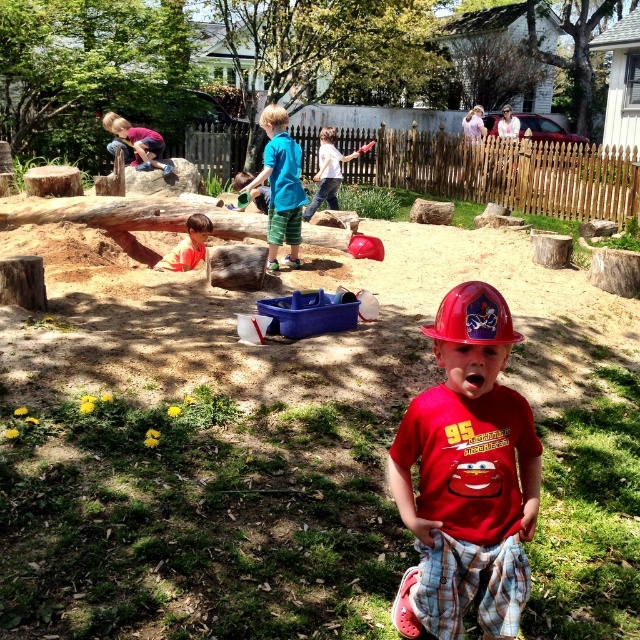
Question: Which is nearer to the matte purple shirt at upper left?

Choices:
 (A) blue cotton shirt at center
 (B) white cotton shirt at center
 (C) red matte helmet at center
 (D) red hard hat at center

Answer: (B)

Question: Is red matte helmet at center below matte purple shirt at upper left?

Choices:
 (A) no
 (B) yes

Answer: (B)

Question: Which of the following is the farthest from the observer?

Choices:
 (A) (294, 230)
 (B) (497, 300)

Answer: (A)

Question: Does blue cotton shirt at center appear under red hard hat at center?

Choices:
 (A) no
 (B) yes

Answer: (A)

Question: Is matte purple shirt at upper left smaller than white cotton shirt at center?

Choices:
 (A) no
 (B) yes

Answer: (B)

Question: Among these objects, which one is farthest from the camera?

Choices:
 (A) matte purple shirt at upper left
 (B) orange shirt at center
 (C) blue cotton shirt at center
 (D) red hard hat at center

Answer: (A)